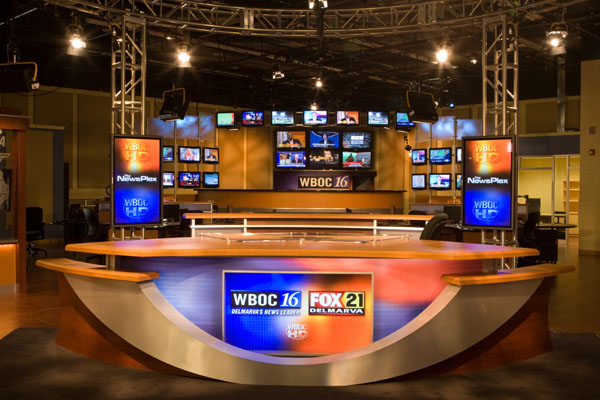
Locate an element on the screen. The width and height of the screenshot is (600, 400). light is located at coordinates (182, 52), (311, 72), (443, 38), (562, 55).